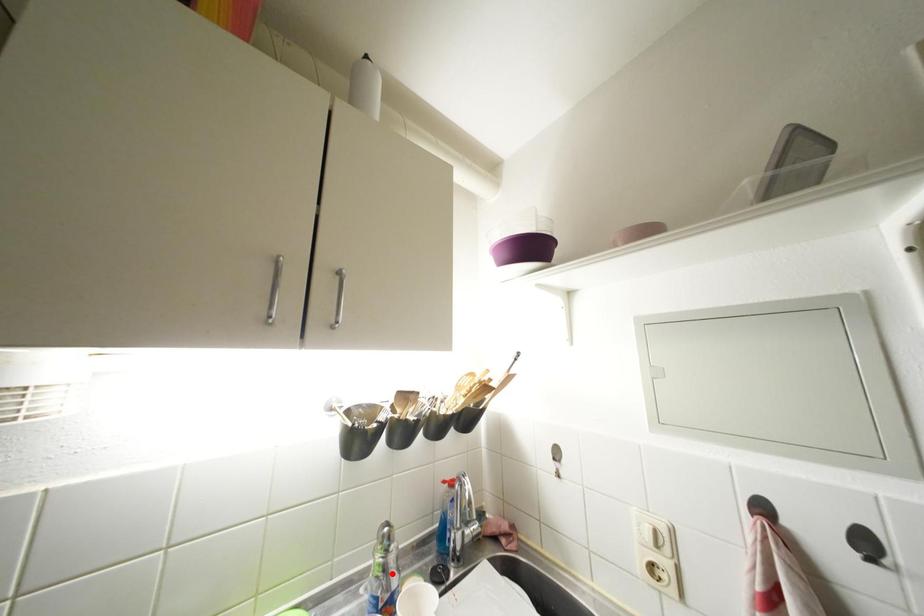
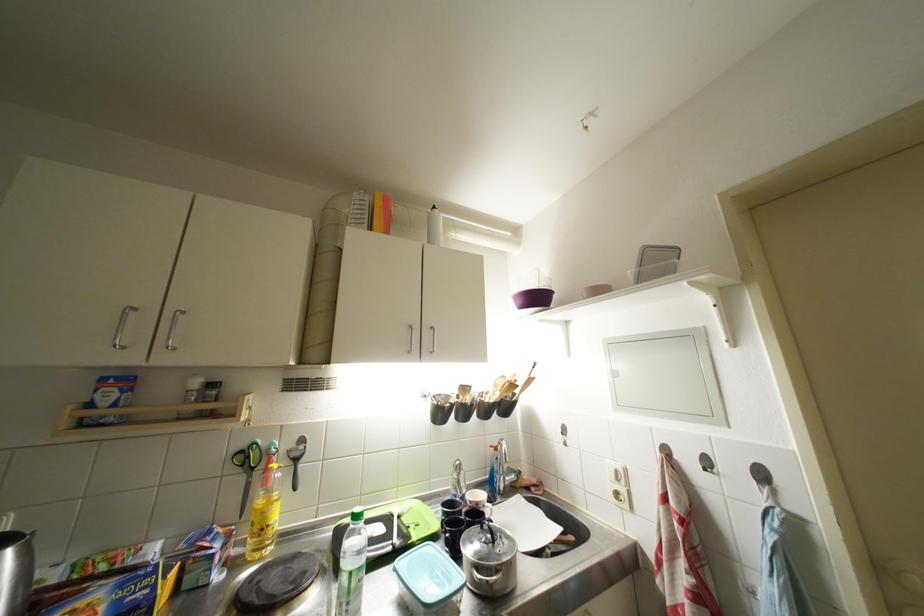
Locate, in the second image, the point that corresponds to the highlighted location in the first image.

(466, 487)